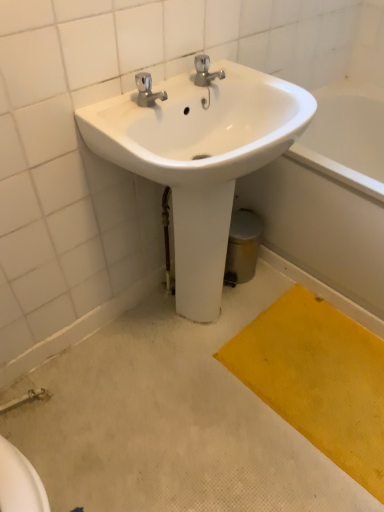
Question: Is white glossy bathtub at lower right at the left side of white glossy sink at upper center?

Choices:
 (A) yes
 (B) no

Answer: (B)

Question: Does white glossy bathtub at lower right have a lesser width compared to white glossy sink at upper center?

Choices:
 (A) no
 (B) yes

Answer: (A)

Question: From a real-world perspective, is white glossy bathtub at lower right on top of white glossy sink at upper center?

Choices:
 (A) no
 (B) yes

Answer: (A)

Question: Is white glossy sink at upper center inside white glossy bathtub at lower right?

Choices:
 (A) yes
 (B) no

Answer: (B)

Question: Considering the relative sizes of white glossy bathtub at lower right and white glossy sink at upper center in the image provided, is white glossy bathtub at lower right wider than white glossy sink at upper center?

Choices:
 (A) no
 (B) yes

Answer: (B)

Question: From a real-world perspective, is yellow fabric doormat at lower right positioned above or below white glossy sink at upper center?

Choices:
 (A) below
 (B) above

Answer: (A)

Question: Is point pyautogui.click(x=289, y=400) positioned closer to the camera than point pyautogui.click(x=268, y=90)?

Choices:
 (A) closer
 (B) farther

Answer: (B)

Question: From the image's perspective, is yellow fabric doormat at lower right positioned above or below white glossy sink at upper center?

Choices:
 (A) below
 (B) above

Answer: (A)

Question: In terms of size, does yellow fabric doormat at lower right appear bigger or smaller than white glossy sink at upper center?

Choices:
 (A) small
 (B) big

Answer: (A)

Question: Would you say yellow fabric doormat at lower right is to the left or to the right of white glossy bathtub at lower right in the picture?

Choices:
 (A) right
 (B) left

Answer: (B)

Question: From the image's perspective, relative to white glossy bathtub at lower right, is yellow fabric doormat at lower right above or below?

Choices:
 (A) above
 (B) below

Answer: (B)

Question: Is point (379, 497) positioned closer to the camera than point (355, 209)?

Choices:
 (A) farther
 (B) closer

Answer: (B)

Question: Is yellow fabric doormat at lower right wider or thinner than white glossy bathtub at lower right?

Choices:
 (A) wide
 (B) thin

Answer: (B)

Question: Relative to white glossy bathtub at lower right, is white glossy sink at upper center in front or behind?

Choices:
 (A) behind
 (B) front

Answer: (B)

Question: Is point (211, 95) positioned closer to the camera than point (329, 269)?

Choices:
 (A) farther
 (B) closer

Answer: (B)